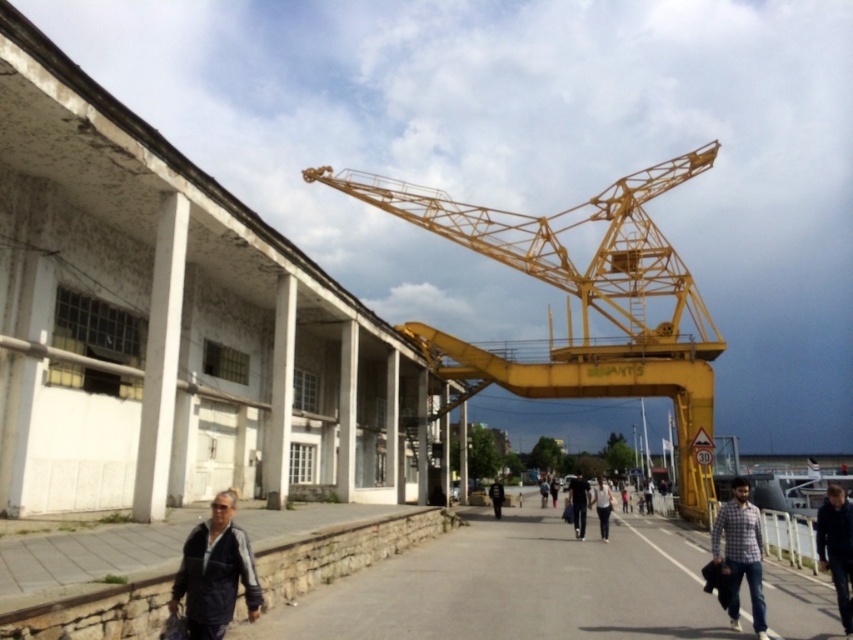
You are standing at the center of the image and want to place a new object at the same position as the dark blue jeans at center. What are the coordinates where you should place it?

The coordinates for the dark blue jeans at center are 0.787 on the x axis and 0.680 on the y axis, so you should place the new object at point (579, 502).

You are a fashion designer observing a model wearing both the dark blue jeans at center and the black leather jacket at center. Which clothing item takes up more space on the model?

The dark blue jeans at center is bigger than black leather jacket at center, so the dark blue jeans at center takes up more space on the model.

You are a construction worker standing at the base of the yellow metallic crane at center. You need to place a tool box next to the dark blue jacket at lower right. Considering the size difference between the crane and the jacket, will the tool box be closer to the crane or the jacket?

The yellow metallic crane at center is larger than the dark blue jacket at lower right. Since the tool box is placed next to the jacket, it will be closer to the dark blue jacket at lower right than the crane.